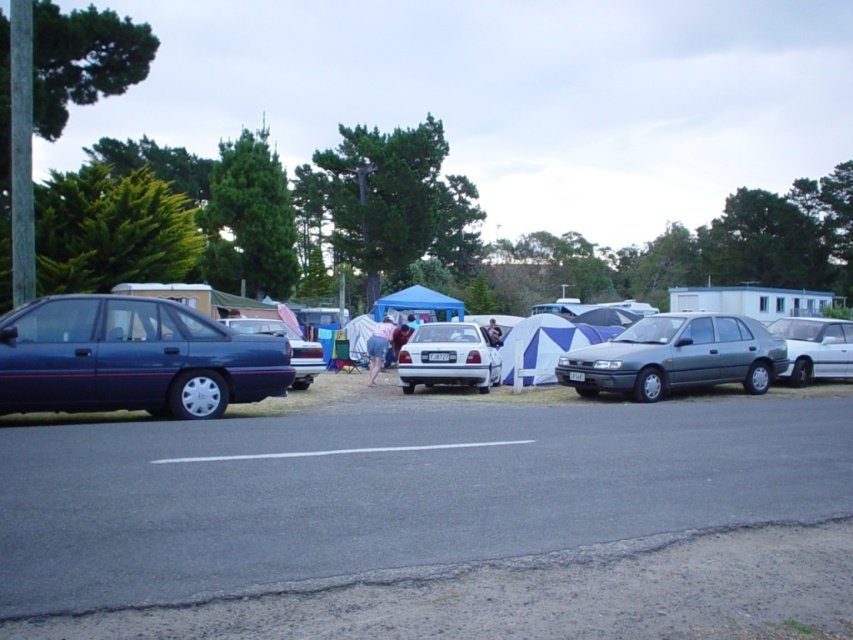
Question: Is satin white sedan at center positioned behind blue fabric tent at center?

Choices:
 (A) yes
 (B) no

Answer: (B)

Question: Which of the following is the closest to the observer?

Choices:
 (A) dark blue jeans at center
 (B) light blue denim shorts at center
 (C) black asphalt parking lot at lower left
 (D) blue fabric tent at center

Answer: (C)

Question: Does satin silver sedan at center appear under light blue denim shorts at center?

Choices:
 (A) no
 (B) yes

Answer: (A)

Question: Among these objects, which one is nearest to the camera?

Choices:
 (A) dark blue jeans at center
 (B) light blue denim shorts at center
 (C) black asphalt parking lot at lower left
 (D) matte blue sedan at left

Answer: (C)

Question: Estimate the real-world distances between objects in this image. Which object is farther from the matte blue sedan at left?

Choices:
 (A) black asphalt parking lot at lower left
 (B) light blue denim shorts at center

Answer: (B)

Question: Can you confirm if white glossy sedan at right is positioned to the right of matte blue sedan at center?

Choices:
 (A) yes
 (B) no

Answer: (A)